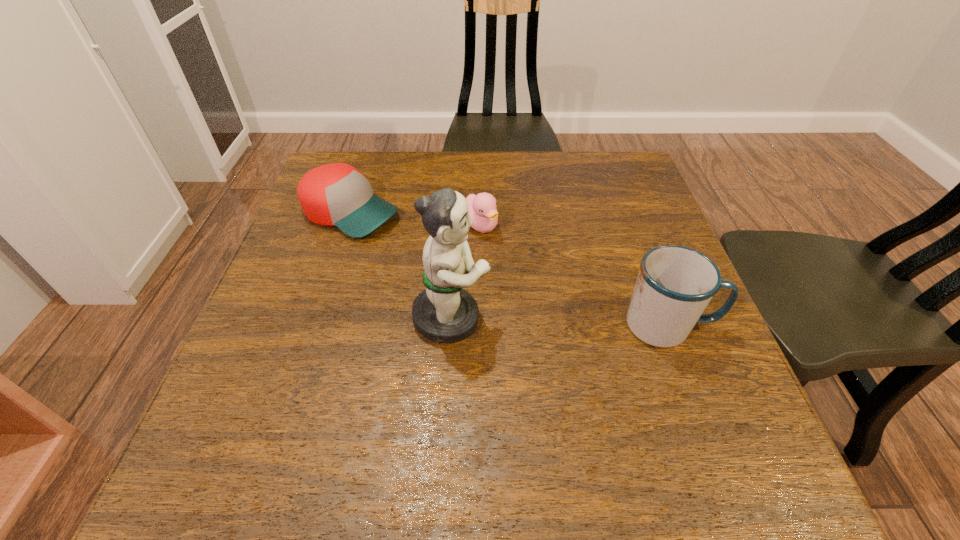
The image size is (960, 540). Find the location of `object that is the second closest to the figurine`. object that is the second closest to the figurine is located at coordinates click(337, 194).

The width and height of the screenshot is (960, 540). What are the coordinates of `object that is the second closest to the figurine` in the screenshot? It's located at (337, 194).

I want to click on free space that satisfies the following two spatial constraints: 1. on the front side of the duckling; 2. on the right side of the baseball cap, so click(x=346, y=226).

Locate an element on the screen. free space that satisfies the following two spatial constraints: 1. on the front side of the leftmost object; 2. on the front-facing side of the figurine is located at coordinates (315, 318).